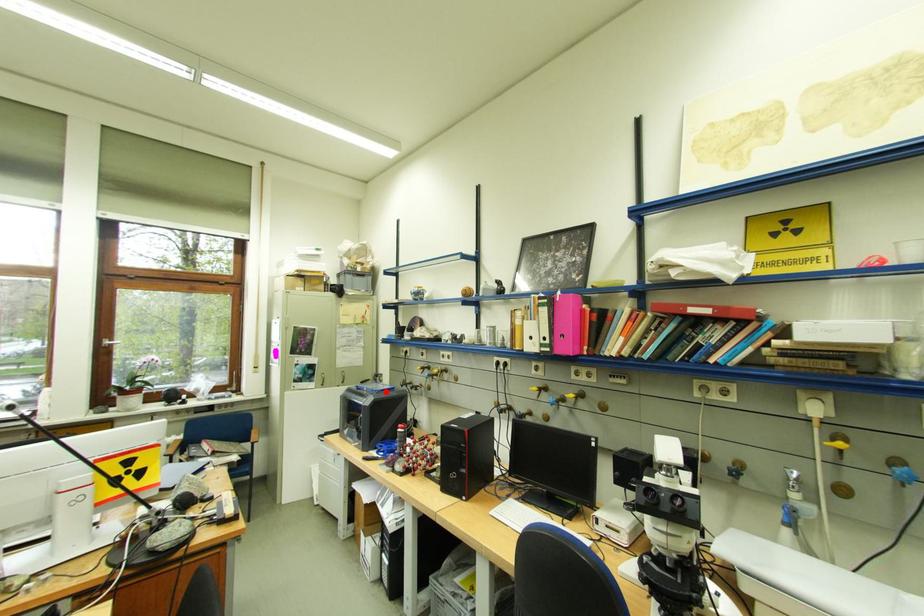
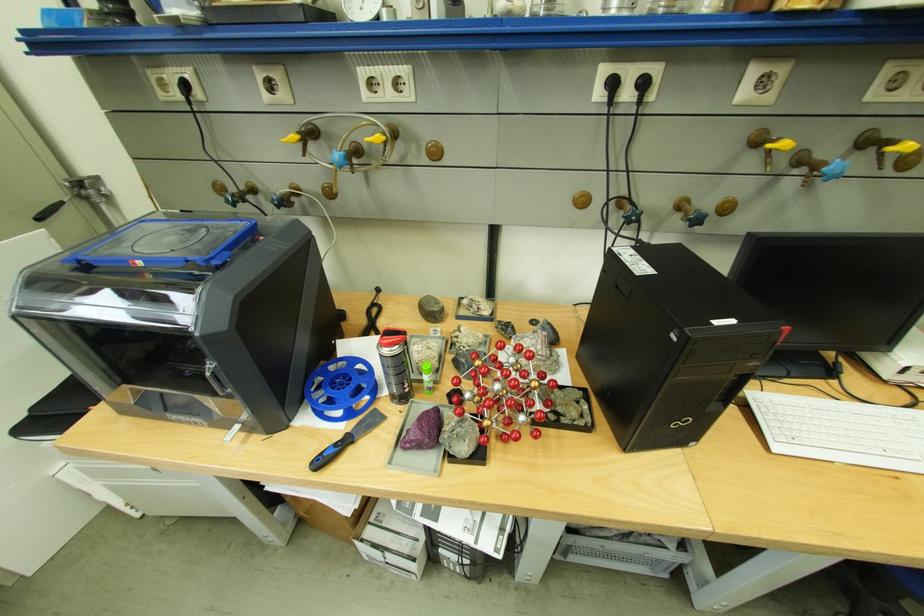
Where in the second image is the point corresponding to the highlighted location from the first image?

(219, 261)